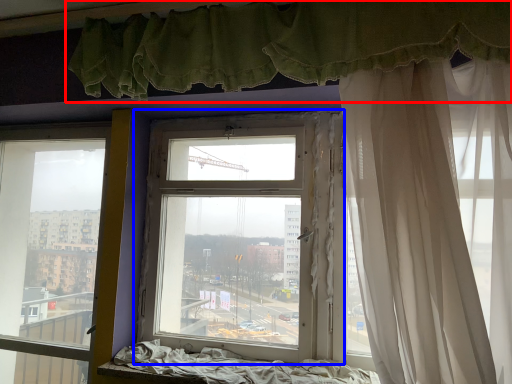
Question: Which point is further to the camera, curtain (highlighted by a red box) or window (highlighted by a blue box)?

Choices:
 (A) curtain
 (B) window

Answer: (B)